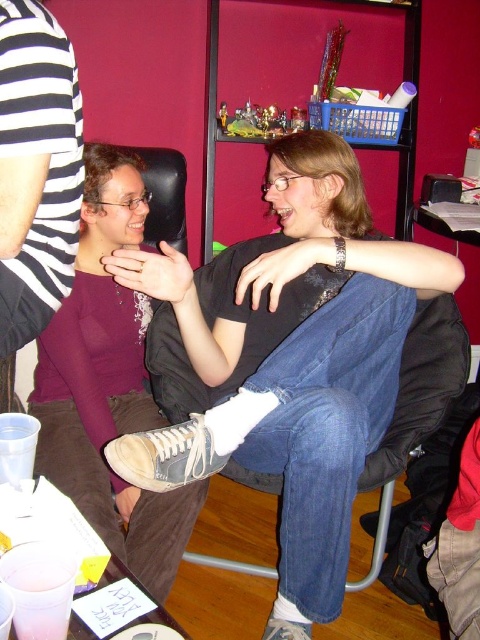
Question: Among these objects, which one is farthest from the camera?

Choices:
 (A) denim jeans at center
 (B) matte purple sweater at center

Answer: (B)

Question: In this image, where is denim jeans at center located relative to matte purple sweater at center?

Choices:
 (A) below
 (B) above

Answer: (B)

Question: Which object is closer to the camera taking this photo?

Choices:
 (A) matte purple sweater at center
 (B) denim jeans at center

Answer: (B)

Question: Can you confirm if denim jeans at center is wider than matte purple sweater at center?

Choices:
 (A) no
 (B) yes

Answer: (B)

Question: Does denim jeans at center appear on the left side of matte purple sweater at center?

Choices:
 (A) yes
 (B) no

Answer: (B)